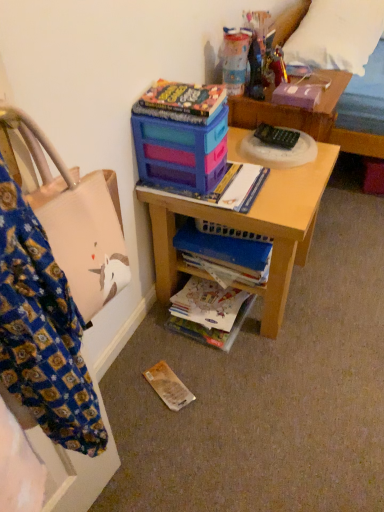
Locate an element on the screen. vacant space behind brown paper book at lower center, the third paperback book positioned from the right is located at coordinates (162, 345).